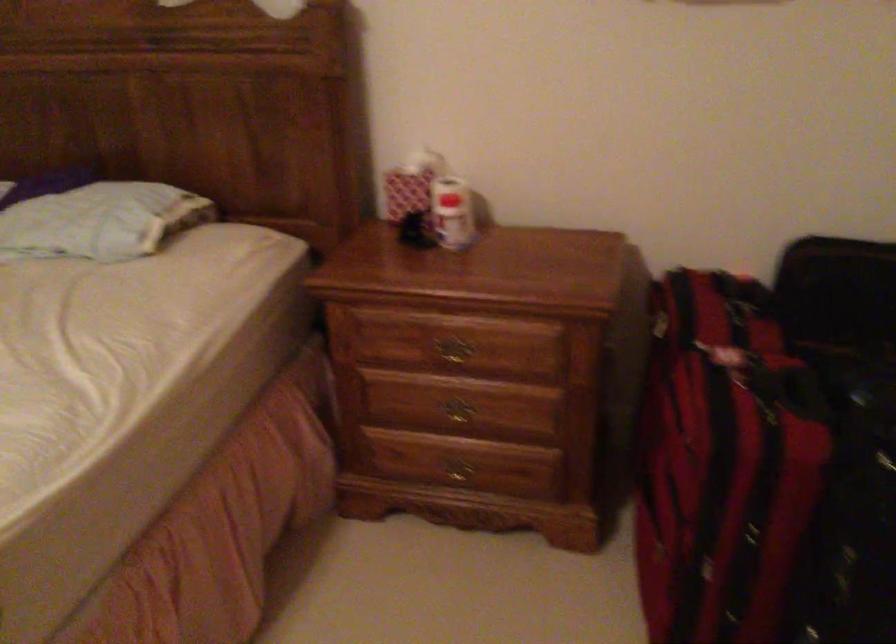
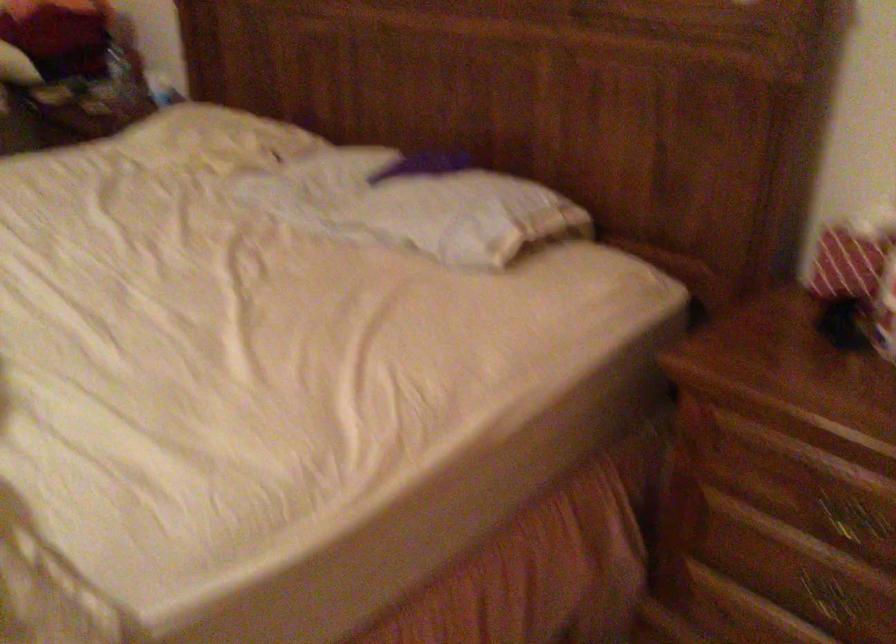
Question: The images are taken continuously from a first-person perspective. In which direction is your viewpoint rotating?

Choices:
 (A) Left
 (B) Right
 (C) Up
 (D) Down

Answer: (A)